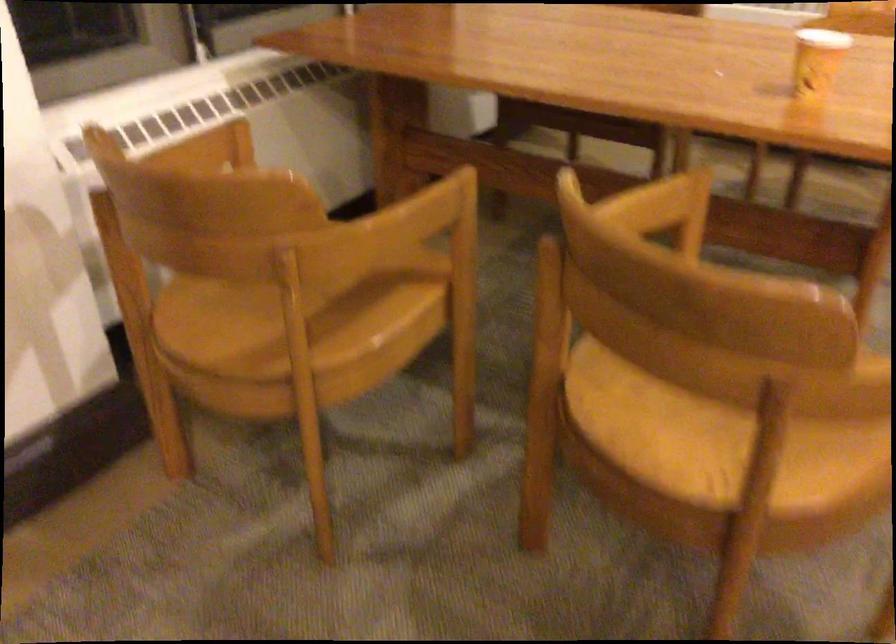
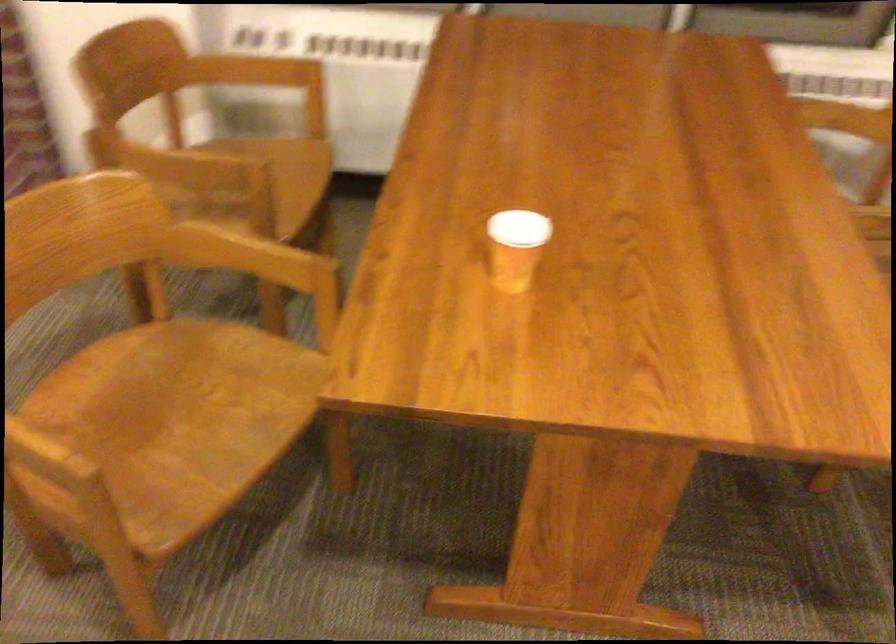
Find the pixel in the second image that matches (x=406, y=221) in the first image.

(169, 163)